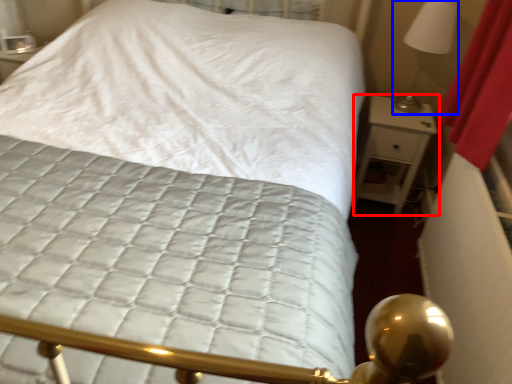
Question: Which object is further to the camera taking this photo, nightstand (highlighted by a red box) or bedside lamp (highlighted by a blue box)?

Choices:
 (A) nightstand
 (B) bedside lamp

Answer: (A)